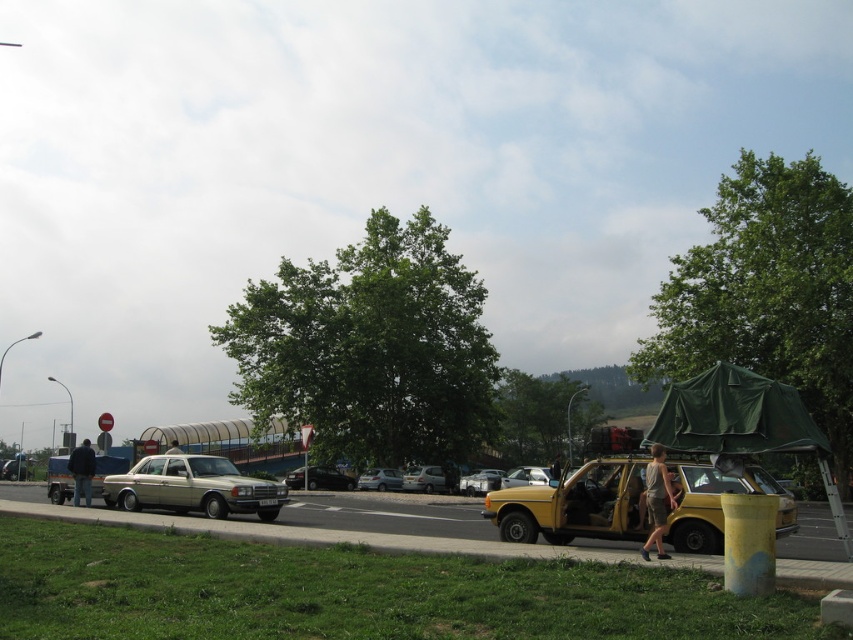
Question: Which object is positioned closest to the silver metallic sedan at left?

Choices:
 (A) light brown leather jacket at center
 (B) green grass at lower left
 (C) silver metallic hatchback at center

Answer: (C)

Question: Is dark blue jeans at left positioned behind silver metallic sedan at left?

Choices:
 (A) no
 (B) yes

Answer: (A)

Question: Which point is farther to the camera?

Choices:
 (A) dark blue jeans at left
 (B) green grass at lower left
 (C) metallic gold car at center

Answer: (C)

Question: Observing the image, what is the correct spatial positioning of gold metallic sedan at center in reference to shiny black sedan at center?

Choices:
 (A) right
 (B) left

Answer: (A)

Question: Is silver metallic hatchback at center positioned at the back of metallic silver sedan at center?

Choices:
 (A) no
 (B) yes

Answer: (B)

Question: Which object is the closest to the dark blue jeans at left?

Choices:
 (A) metallic gold car at center
 (B) shiny black sedan at center
 (C) metallic silver sedan at center

Answer: (B)